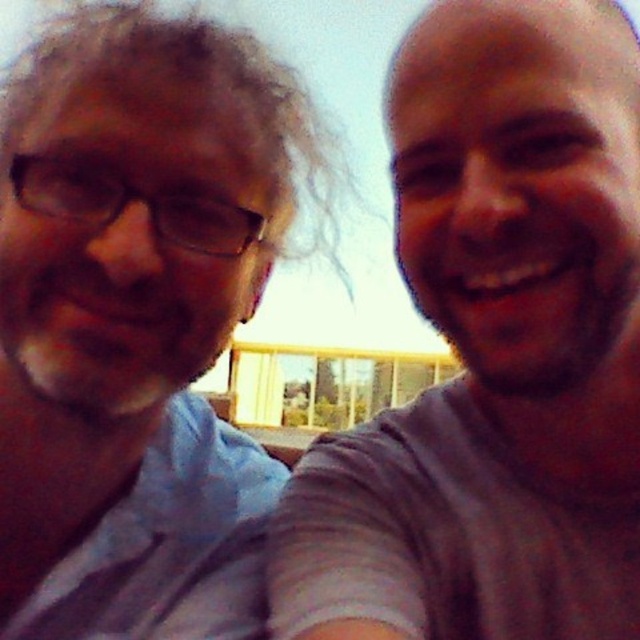
Question: Does gray cotton shirt at upper right have a greater width compared to matte blue shirt at left?

Choices:
 (A) no
 (B) yes

Answer: (B)

Question: Can you confirm if gray cotton shirt at upper right is smaller than matte blue shirt at left?

Choices:
 (A) no
 (B) yes

Answer: (B)

Question: Is gray cotton shirt at upper right behind matte blue shirt at left?

Choices:
 (A) no
 (B) yes

Answer: (A)